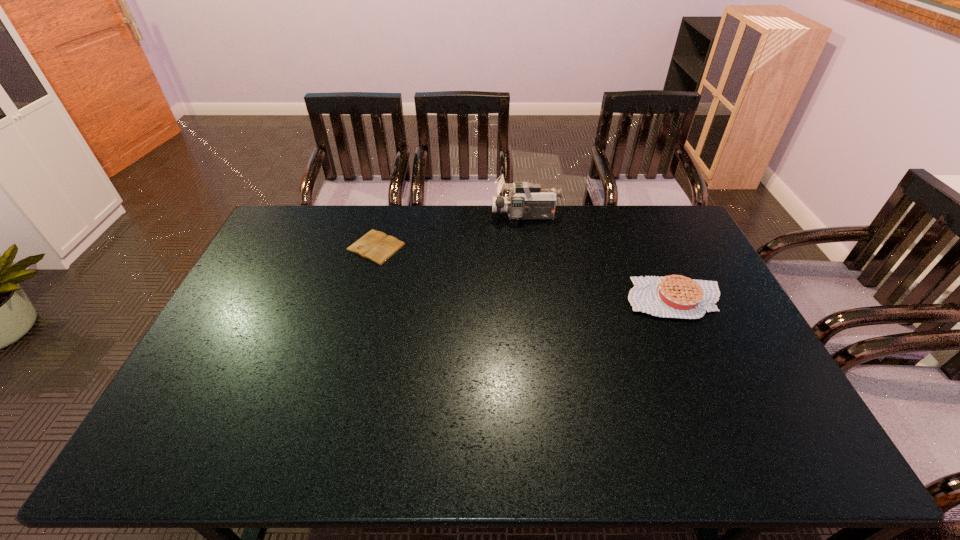
Identify the location of vacant space at the far right corner of the desktop. The image size is (960, 540). (637, 210).

Image resolution: width=960 pixels, height=540 pixels. In order to click on free space between the pie and the leftmost object in this screenshot , I will do `click(526, 273)`.

Where is `empty space between the second nearest object and the nearest object`? The image size is (960, 540). empty space between the second nearest object and the nearest object is located at coordinates (526, 273).

Identify the location of unoccupied position between the book and the camcorder. The height and width of the screenshot is (540, 960). (450, 232).

Identify the location of free space between the leftmost object and the pie. This screenshot has width=960, height=540. (526, 273).

Locate an element on the screen. The width and height of the screenshot is (960, 540). vacant space that is in between the shortest object and the tallest object is located at coordinates (450, 232).

Where is `vacant area between the shortest object and the second object from left to right`? This screenshot has width=960, height=540. vacant area between the shortest object and the second object from left to right is located at coordinates (450, 232).

Locate an element on the screen. The width and height of the screenshot is (960, 540). vacant area that lies between the camcorder and the second shortest object is located at coordinates (600, 257).

The height and width of the screenshot is (540, 960). I want to click on free point between the rightmost object and the second object from left to right, so click(600, 257).

Find the location of a particular element. The image size is (960, 540). free area in between the shortest object and the rightmost object is located at coordinates (526, 273).